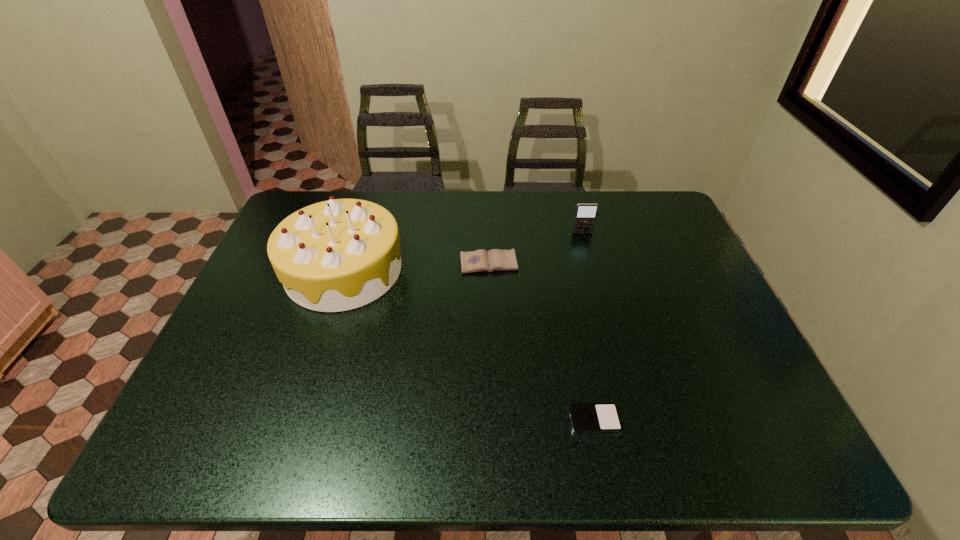
The width and height of the screenshot is (960, 540). Find the location of `object identified as the second closest to the shorter iPod`. object identified as the second closest to the shorter iPod is located at coordinates (340, 254).

Select which object appears as the third closest to the third object from right to left. Please provide its 2D coordinates. Your answer should be formatted as a tuple, i.e. [(x, y)], where the tuple contains the x and y coordinates of a point satisfying the conditions above.

[(585, 417)]